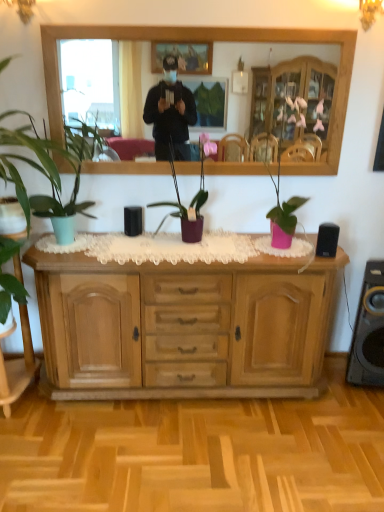
Question: Do you think wooden mirror at upper center is within matte purple pot at center, which is the 1th houseplant from right to left, or outside of it?

Choices:
 (A) inside
 (B) outside

Answer: (B)

Question: Is point (100, 44) closer or farther from the camera than point (183, 241)?

Choices:
 (A) farther
 (B) closer

Answer: (A)

Question: Based on their relative distances, which object is nearer to the black matte speaker at right?

Choices:
 (A) matte purple pot at center, which is the third houseplant in left-to-right order
 (B) green matte plant at left, positioned as the first houseplant in left-to-right order
 (C) matte green plant at left, the second houseplant when ordered from right to left
 (D) light brown wood cabinet at center
 (E) black glossy speaker at right

Answer: (E)

Question: Estimate the real-world distances between objects in this image. Which object is closer to the light brown wood cabinet at center?

Choices:
 (A) green matte plant at left, positioned as the first houseplant in left-to-right order
 (B) matte green plant at left, the 2th houseplant in the left-to-right sequence
 (C) matte purple pot at center, which is the third houseplant in left-to-right order
 (D) black glossy speaker at right
 (E) black matte speaker at right

Answer: (C)